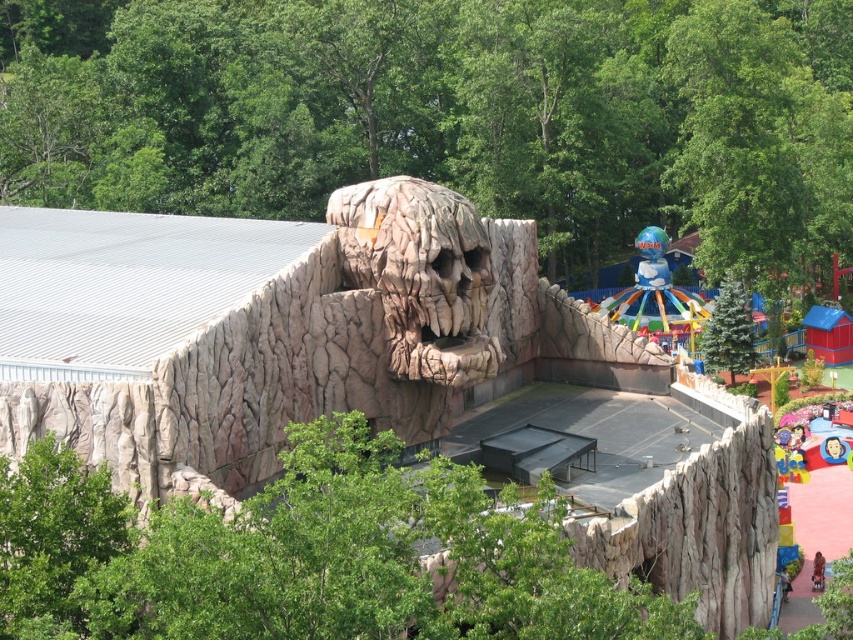
You are a stagehand setting up for a performance. You have to place a 1.5 meter tall banner between the multicolored plastic carousel at center and the green textured pine tree at center right. Will the banner fit vertically between them?

The multicolored plastic carousel at center is taller than the green textured pine tree at center right. Since the banner is 1.5 meters tall, it can be placed vertically between them as the carousel provides enough vertical space.

You are a stage designer preparing for a spooky Halloween event. You have a rough stone skull at center and a green textured pine tree at center right. Where should you place a spotlight to highlight both objects without casting shadows over the stage? Consider their positions and heights.

The rough stone skull at center is above the green textured pine tree at center right. To avoid shadows, place the spotlight above and behind the rough stone skull at center so it illuminates both objects while casting shadows downward away from the stage.

You are a stagehand setting up for a performance. You have to place a banner between the rough stone skull at center and the multicolored plastic carousel at center. Which object should the banner be closer to if you want it to be visible from the front row seats?

The banner should be closer to the rough stone skull at center because it is shorter than the multicolored plastic carousel at center, ensuring it doesn